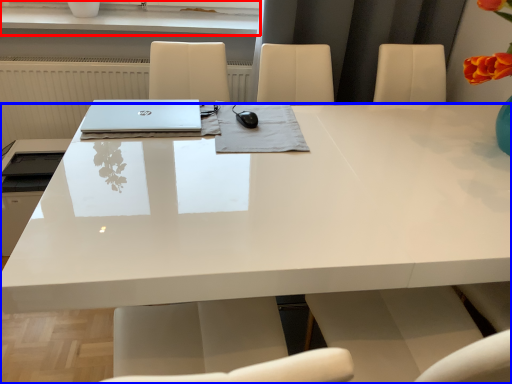
Question: Among these objects, which one is nearest to the camera, window sill (highlighted by a red box) or desk (highlighted by a blue box)?

Choices:
 (A) window sill
 (B) desk

Answer: (B)